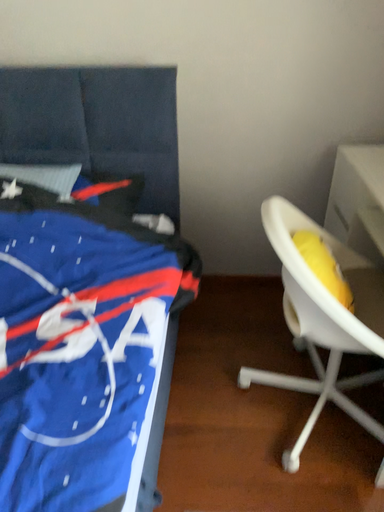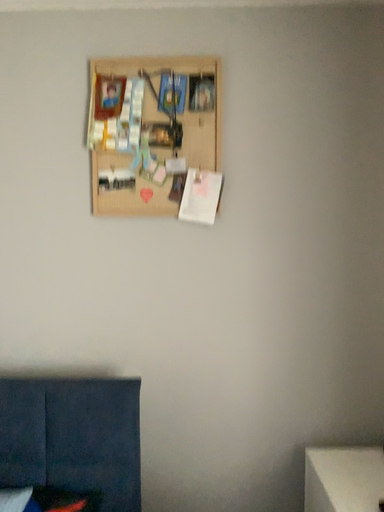
Question: How did the camera likely rotate when shooting the video?

Choices:
 (A) rotated upward
 (B) rotated downward

Answer: (A)